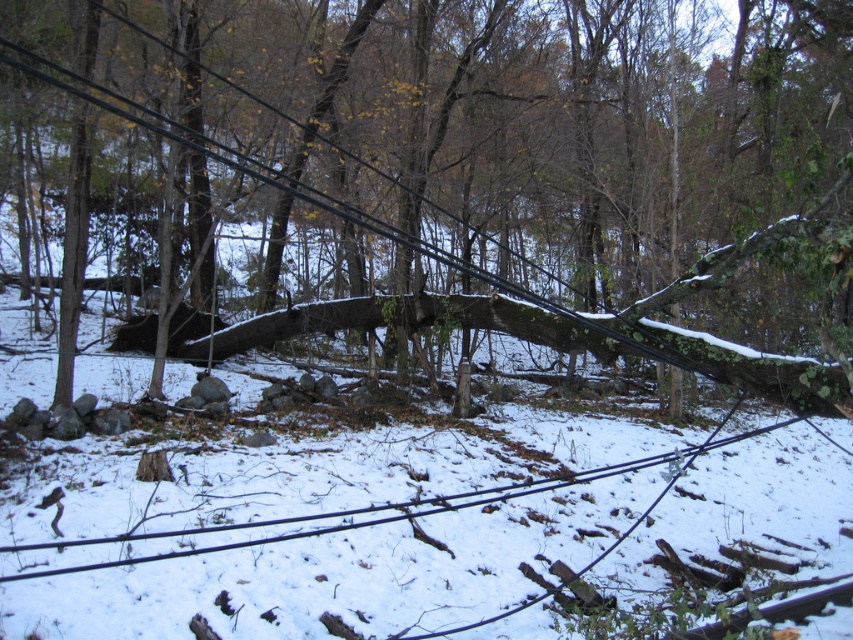
Does brown rough tree trunk at center have a greater height compared to black wire at lower center?

Correct, brown rough tree trunk at center is much taller as black wire at lower center.

Can you confirm if brown rough tree trunk at center is bigger than black wire at lower center?

Correct, brown rough tree trunk at center is larger in size than black wire at lower center.

Which is behind, point (422, 284) or point (247, 541)?

The point (422, 284) is more distant.

Where is `brown rough tree trunk at center`? The image size is (853, 640). brown rough tree trunk at center is located at coordinates (527, 168).